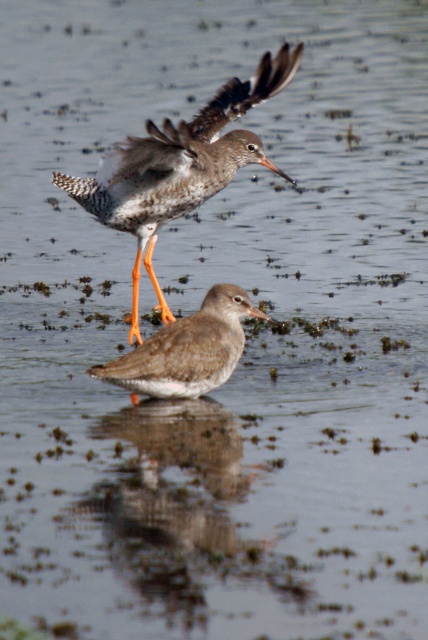
Question: Is speckled feathered bird at upper center thinner than brown speckled sandpiper at center?

Choices:
 (A) no
 (B) yes

Answer: (A)

Question: Can you confirm if speckled feathered bird at upper center is positioned above brown speckled sandpiper at center?

Choices:
 (A) yes
 (B) no

Answer: (A)

Question: Which point appears farthest from the camera in this image?

Choices:
 (A) (258, 92)
 (B) (244, 296)

Answer: (A)

Question: Can you confirm if speckled feathered bird at upper center is positioned to the right of brown speckled sandpiper at center?

Choices:
 (A) no
 (B) yes

Answer: (A)